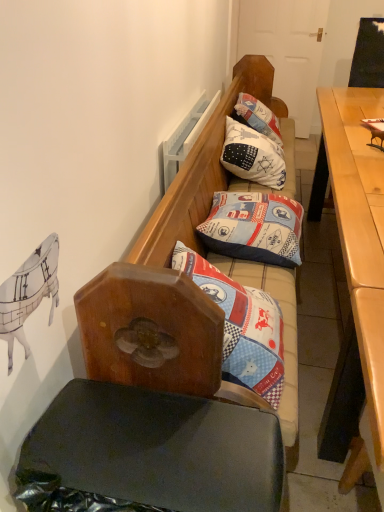
Based on the photo, what is the approximate width of patchwork fabric pillow at upper center, the 1th pillow when ordered from back to front?

patchwork fabric pillow at upper center, the 1th pillow when ordered from back to front, is 15.83 inches in width.

This screenshot has height=512, width=384. Describe the element at coordinates (253, 156) in the screenshot. I see `patchwork fabric pillow at upper center, the 1th pillow when ordered from back to front` at that location.

You are a GUI agent. You are given a task and a screenshot of the screen. Output one action in this format:
    pyautogui.click(x=<x>, y=<y>)
    Task: Click on the wooden bench with patterned cushions at center
    This screenshot has width=384, height=512.
    Given the screenshot: What is the action you would take?
    point(161,381)

The width and height of the screenshot is (384, 512). I want to click on desk below the patchwork fabric pillow at upper center, acting as the first pillow starting from the top (from the image's perspective), so click(x=358, y=251).

Considering the sizes of objects light brown wooden desk at right and patchwork fabric pillow at upper center, the 1th pillow when ordered from back to front, in the image provided, who is thinner, light brown wooden desk at right or patchwork fabric pillow at upper center, the 1th pillow when ordered from back to front,?

Thinner between the two is patchwork fabric pillow at upper center, the 1th pillow when ordered from back to front.

Based on the photo, between light brown wooden desk at right and patchwork fabric pillow at upper center, the 2th pillow in the bottom-to-top sequence, which one is positioned behind?

patchwork fabric pillow at upper center, the 2th pillow in the bottom-to-top sequence, is behind.

Can you confirm if light brown wooden desk at right is taller than patchwork fabric pillow at upper center, acting as the first pillow starting from the top?

Correct, light brown wooden desk at right is much taller as patchwork fabric pillow at upper center, acting as the first pillow starting from the top.

Considering the relative sizes of light brown wooden desk at right and patchwork fabric pillow at center, placed as the second pillow when sorted from top to bottom, in the image provided, is light brown wooden desk at right taller than patchwork fabric pillow at center, placed as the second pillow when sorted from top to bottom,?

Yes, light brown wooden desk at right is taller than patchwork fabric pillow at center, placed as the second pillow when sorted from top to bottom.

Based on the photo, in the image, is light brown wooden desk at right on the left side or the right side of patchwork fabric pillow at center, which is counted as the first pillow, starting from the front?

light brown wooden desk at right is to the right of patchwork fabric pillow at center, which is counted as the first pillow, starting from the front.

Can you tell me how much light brown wooden desk at right and patchwork fabric pillow at center, which appears as the 1th pillow when ordered from the bottom, differ in facing direction?

The angle between the facing direction of light brown wooden desk at right and the facing direction of patchwork fabric pillow at center, which appears as the 1th pillow when ordered from the bottom, is 0.804 degrees.

Image resolution: width=384 pixels, height=512 pixels. Find the location of `pillow behind the patchwork fabric pillow at center, which appears as the 1th pillow when ordered from the bottom`. pillow behind the patchwork fabric pillow at center, which appears as the 1th pillow when ordered from the bottom is located at coordinates (253, 156).

Is patchwork fabric pillow at center, which is counted as the first pillow, starting from the front, bigger than patchwork fabric pillow at upper center, the 2th pillow in the bottom-to-top sequence?

No.

Is patchwork fabric pillow at center, placed as the second pillow when sorted from top to bottom, oriented towards patchwork fabric pillow at upper center, the second pillow when ordered from front to back?

No.

Are patchwork fabric pillow at center, which is counted as the first pillow, starting from the front, and light brown wooden desk at right located far from each other?

patchwork fabric pillow at center, which is counted as the first pillow, starting from the front, is actually quite close to light brown wooden desk at right.

Considering the relative sizes of patchwork fabric pillow at center, which appears as the second pillow when viewed from the back, and light brown wooden desk at right in the image provided, is patchwork fabric pillow at center, which appears as the second pillow when viewed from the back, thinner than light brown wooden desk at right?

Correct, the width of patchwork fabric pillow at center, which appears as the second pillow when viewed from the back, is less than that of light brown wooden desk at right.

Visually, is patchwork fabric pillow at center, placed as the second pillow when sorted from top to bottom, positioned to the left or to the right of light brown wooden desk at right?

patchwork fabric pillow at center, placed as the second pillow when sorted from top to bottom, is positioned on light brown wooden desk at right's left side.

From the image's perspective, is patchwork fabric pillow at center, which appears as the 1th pillow when ordered from the bottom, located above or below light brown wooden desk at right?

Clearly, from the image's perspective, patchwork fabric pillow at center, which appears as the 1th pillow when ordered from the bottom, is above light brown wooden desk at right.

In terms of height, does wooden bench with patterned cushions at center look taller or shorter compared to patchwork fabric pillow at center, which appears as the 1th pillow when ordered from the bottom?

wooden bench with patterned cushions at center is taller than patchwork fabric pillow at center, which appears as the 1th pillow when ordered from the bottom.

Is wooden bench with patterned cushions at center in contact with patchwork fabric pillow at center, which is counted as the first pillow, starting from the front?

wooden bench with patterned cushions at center is not next to patchwork fabric pillow at center, which is counted as the first pillow, starting from the front, and they're not touching.

Considering the sizes of wooden bench with patterned cushions at center and patchwork fabric pillow at center, which appears as the second pillow when viewed from the back, in the image, is wooden bench with patterned cushions at center wider or thinner than patchwork fabric pillow at center, which appears as the second pillow when viewed from the back,?

wooden bench with patterned cushions at center is wider than patchwork fabric pillow at center, which appears as the second pillow when viewed from the back.

Looking at this image, is wooden bench with patterned cushions at center behind patchwork fabric pillow at center, which appears as the second pillow when viewed from the back?

No, wooden bench with patterned cushions at center is closer to the camera.

Considering the sizes of objects patchwork fabric pillow at upper center, acting as the first pillow starting from the top, and wooden bench with patterned cushions at center in the image provided, who is wider, patchwork fabric pillow at upper center, acting as the first pillow starting from the top, or wooden bench with patterned cushions at center?

wooden bench with patterned cushions at center is wider.

Considering the sizes of objects patchwork fabric pillow at upper center, the 2th pillow in the bottom-to-top sequence, and wooden bench with patterned cushions at center in the image provided, who is smaller, patchwork fabric pillow at upper center, the 2th pillow in the bottom-to-top sequence, or wooden bench with patterned cushions at center?

Result: Smaller between the two is patchwork fabric pillow at upper center, the 2th pillow in the bottom-to-top sequence.

The image size is (384, 512). What are the coordinates of `pillow above the wooden bench with patterned cushions at center (from the image's perspective)` in the screenshot? It's located at (253, 156).

Can you confirm if patchwork fabric pillow at center, which is counted as the first pillow, starting from the front, is taller than wooden bench with patterned cushions at center?

No, patchwork fabric pillow at center, which is counted as the first pillow, starting from the front, is not taller than wooden bench with patterned cushions at center.

The image size is (384, 512). In order to click on studio couch below the patchwork fabric pillow at center, placed as the second pillow when sorted from top to bottom (from a real-world perspective) in this screenshot , I will do point(161,381).

In order to click on pillow that is the 2nd object above the light brown wooden desk at right (from a real-world perspective) in this screenshot , I will do `click(253, 156)`.

The width and height of the screenshot is (384, 512). What are the coordinates of `the 1st pillow behind when counting from the light brown wooden desk at right` in the screenshot? It's located at (254, 227).

Estimate the real-world distances between objects in this image. Which object is closer to patchwork fabric pillow at upper center, the 1th pillow when ordered from back to front, light brown wooden desk at right or patchwork fabric pillow at center, which appears as the second pillow when viewed from the back?

patchwork fabric pillow at center, which appears as the second pillow when viewed from the back.

From the image, which object appears to be nearer to patchwork fabric pillow at upper center, acting as the first pillow starting from the top, patchwork fabric pillow at center, which is counted as the first pillow, starting from the front, or wooden bench with patterned cushions at center?

patchwork fabric pillow at center, which is counted as the first pillow, starting from the front, lies closer to patchwork fabric pillow at upper center, acting as the first pillow starting from the top, than the other object.

Which object lies nearer to the anchor point patchwork fabric pillow at center, which appears as the second pillow when viewed from the back, wooden bench with patterned cushions at center or light brown wooden desk at right?

light brown wooden desk at right.

From the image, which object appears to be farther from light brown wooden desk at right, wooden bench with patterned cushions at center or patchwork fabric pillow at upper center, the second pillow when ordered from front to back?

Among the two, wooden bench with patterned cushions at center is located further to light brown wooden desk at right.

When comparing their distances from patchwork fabric pillow at upper center, the 1th pillow when ordered from back to front, does patchwork fabric pillow at center, which appears as the second pillow when viewed from the back, or light brown wooden desk at right seem further?

The object further to patchwork fabric pillow at upper center, the 1th pillow when ordered from back to front, is light brown wooden desk at right.

Which object lies further to the anchor point patchwork fabric pillow at center, which is counted as the first pillow, starting from the front, light brown wooden desk at right or wooden bench with patterned cushions at center?

Among the two, wooden bench with patterned cushions at center is located further to patchwork fabric pillow at center, which is counted as the first pillow, starting from the front.

Considering their positions, is light brown wooden desk at right positioned closer to patchwork fabric pillow at center, which appears as the second pillow when viewed from the back, than patchwork fabric pillow at upper center, the second pillow when ordered from front to back?

light brown wooden desk at right lies closer to patchwork fabric pillow at center, which appears as the second pillow when viewed from the back, than the other object.

When comparing their distances from wooden bench with patterned cushions at center, does patchwork fabric pillow at upper center, the 2th pillow in the bottom-to-top sequence, or light brown wooden desk at right seem further?

Among the two, patchwork fabric pillow at upper center, the 2th pillow in the bottom-to-top sequence, is located further to wooden bench with patterned cushions at center.

This screenshot has width=384, height=512. I want to click on studio couch located between light brown wooden desk at right and patchwork fabric pillow at upper center, the second pillow when ordered from front to back, in the depth direction, so click(x=161, y=381).

This screenshot has height=512, width=384. What are the coordinates of `pillow between wooden bench with patterned cushions at center and patchwork fabric pillow at upper center, the 2th pillow in the bottom-to-top sequence, from front to back` in the screenshot? It's located at (254, 227).

Locate an element on the screen. Image resolution: width=384 pixels, height=512 pixels. studio couch between light brown wooden desk at right and patchwork fabric pillow at center, which appears as the second pillow when viewed from the back, along the z-axis is located at coordinates (161, 381).

Where is `pillow between light brown wooden desk at right and patchwork fabric pillow at upper center, the second pillow when ordered from front to back, from front to back`? pillow between light brown wooden desk at right and patchwork fabric pillow at upper center, the second pillow when ordered from front to back, from front to back is located at coordinates (254, 227).